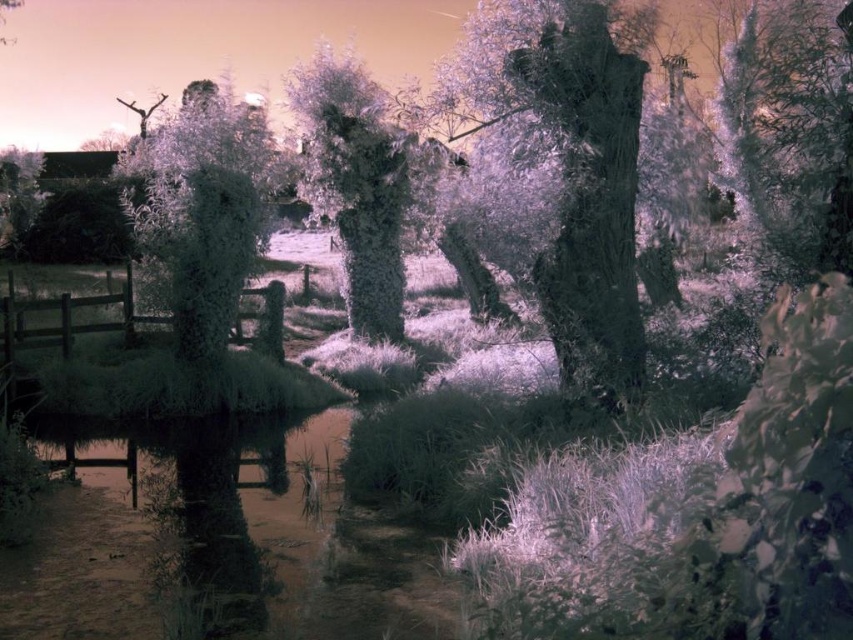
Question: Can you confirm if frosted glass tree at upper left is positioned above silvery textured tree at center?

Choices:
 (A) yes
 (B) no

Answer: (A)

Question: Where is frosted glass tree at upper left located in relation to silvery textured tree at center in the image?

Choices:
 (A) above
 (B) below

Answer: (A)

Question: Can you confirm if frosted glass tree at upper left is bigger than silvery textured tree at center?

Choices:
 (A) no
 (B) yes

Answer: (B)

Question: Which of the following is the closest to the observer?

Choices:
 (A) silvery textured tree at center
 (B) frosted glass tree at upper left

Answer: (B)